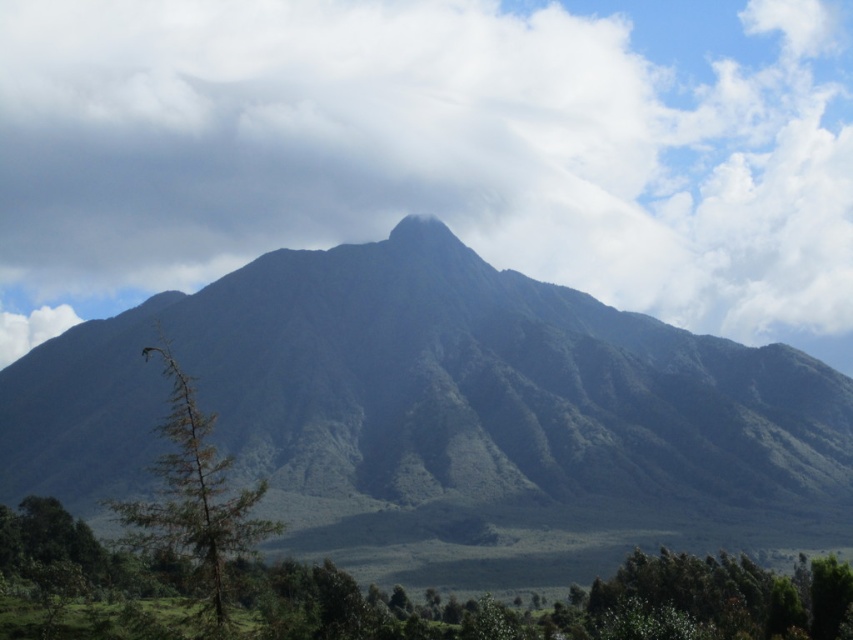
Is point (318, 42) less distant than point (346, 268)?

No, (318, 42) is behind (346, 268).

Between white fluffy cloud at upper center and green grassy mountain at center, which one is positioned higher?

white fluffy cloud at upper center is higher up.

Does point (9, 241) lie behind point (485, 352)?

That is True.

Find the location of a particular element. white fluffy cloud at upper center is located at coordinates (434, 150).

Based on the photo, is white fluffy cloud at upper center wider than green matte mountain peak at center?

Indeed, white fluffy cloud at upper center has a greater width compared to green matte mountain peak at center.

Between white fluffy cloud at upper center and green matte mountain peak at center, which one has less height?

green matte mountain peak at center is shorter.

Who is more distant from viewer, (x=772, y=88) or (x=419, y=218)?

The point (x=772, y=88) is more distant.

Image resolution: width=853 pixels, height=640 pixels. Find the location of `white fluffy cloud at upper center`. white fluffy cloud at upper center is located at coordinates click(434, 150).

Can you confirm if white fluffy cloud at upper center is bigger than green matte tree at left?

Correct, white fluffy cloud at upper center is larger in size than green matte tree at left.

Can you confirm if white fluffy cloud at upper center is wider than green matte tree at left?

Yes, white fluffy cloud at upper center is wider than green matte tree at left.

Which is behind, point (827, 29) or point (212, 600)?

Point (827, 29)

Find the location of `white fluffy cloud at upper center`. white fluffy cloud at upper center is located at coordinates (434, 150).